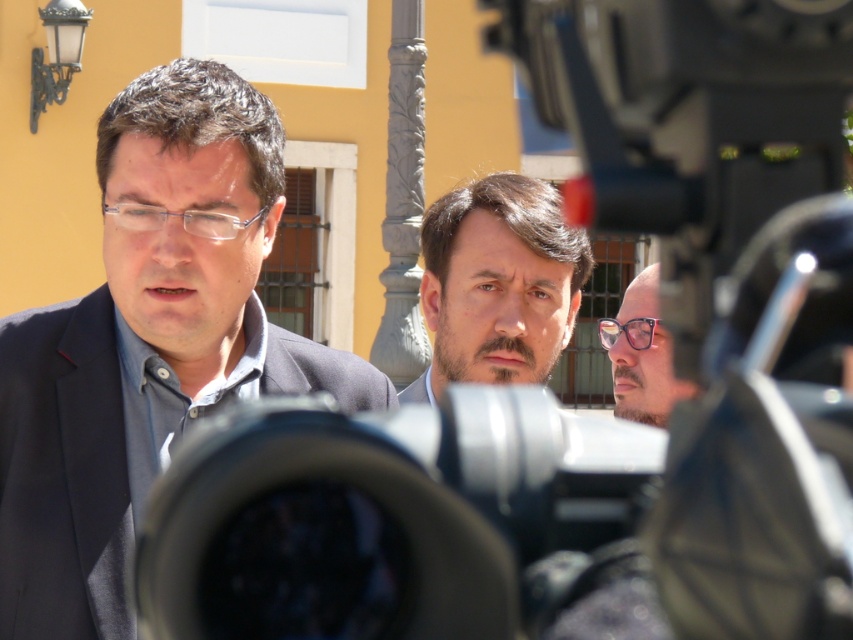
Who is more forward, (x=573, y=284) or (x=643, y=378)?

Point (x=643, y=378) is in front.

Does point (498, 342) lie behind point (662, 364)?

Yes, point (498, 342) is farther from viewer.

This screenshot has height=640, width=853. Identify the location of dark brown hair at center. (497, 284).

Does black plastic camera at center appear on the left side of pink glossy glasses at center?

Correct, you'll find black plastic camera at center to the left of pink glossy glasses at center.

The width and height of the screenshot is (853, 640). What do you see at coordinates (384, 516) in the screenshot?
I see `black plastic camera at center` at bounding box center [384, 516].

Image resolution: width=853 pixels, height=640 pixels. Find the location of `black plastic camera at center`. black plastic camera at center is located at coordinates (384, 516).

In the scene shown: Can you confirm if black plastic camera at center is positioned to the left of dark brown hair at center?

Indeed, black plastic camera at center is positioned on the left side of dark brown hair at center.

Identify the location of black plastic camera at center. (384, 516).

Locate an element on the screen. black plastic camera at center is located at coordinates (384, 516).